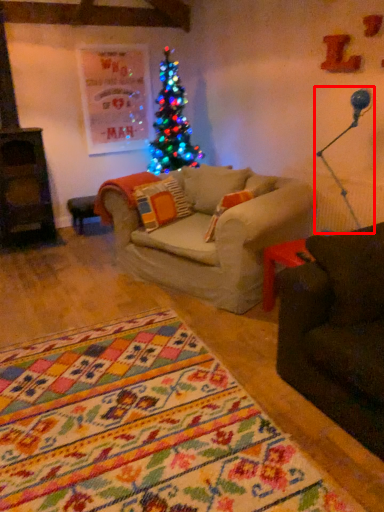
Question: From the image's perspective, what is the correct spatial relationship of lamp (annotated by the red box) in relation to pillow?

Choices:
 (A) below
 (B) above

Answer: (B)